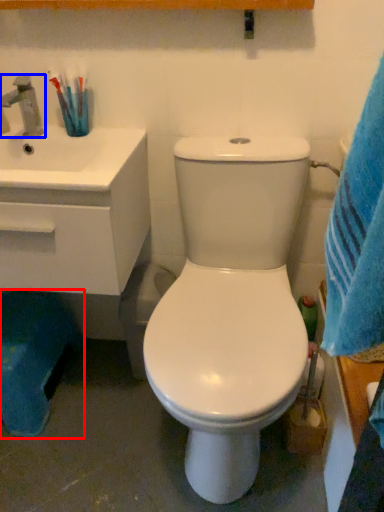
Question: Which point is closer to the camera, potty (highlighted by a red box) or tap (highlighted by a blue box)?

Choices:
 (A) potty
 (B) tap

Answer: (B)